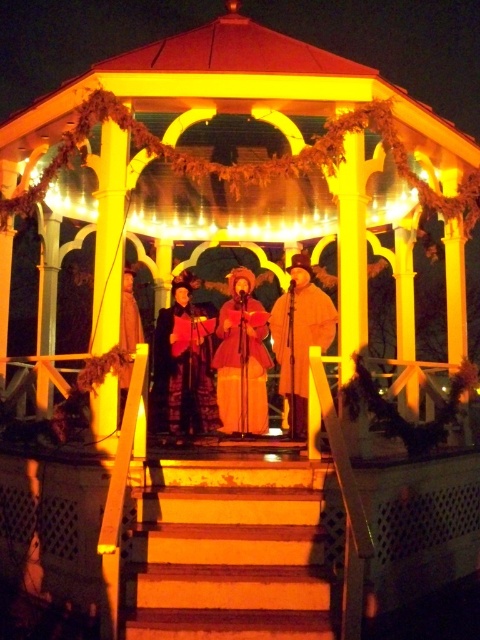
You are a photographer setting up a camera on the wooden stairs at center to capture the velvet red dress at center. To ensure the dress is fully visible, should you adjust your position to the left or right of the stairs?

Since the wooden stairs at center might be wider than velvet red dress at center, you should adjust your position to either the left or right to ensure the dress is fully visible without obstruction from the stairs.

You are standing at the point with coordinates point (159,419) and want to move towards the point with coordinates point (253,493). Is the point you want to reach located in front of you?

Yes, the point (253,493) is in front of point (159,419), so the destination is in front of your current position.

From the picture: You are standing at the entrance of the gazebo and want to hand a gift to the person wearing the velvet red coat at center. According to the scene description, where should you look to find this person?

The velvet red coat at center is located at point (300,337), so you should look towards the center area of the gazebo to find the person wearing the velvet red coat at center.